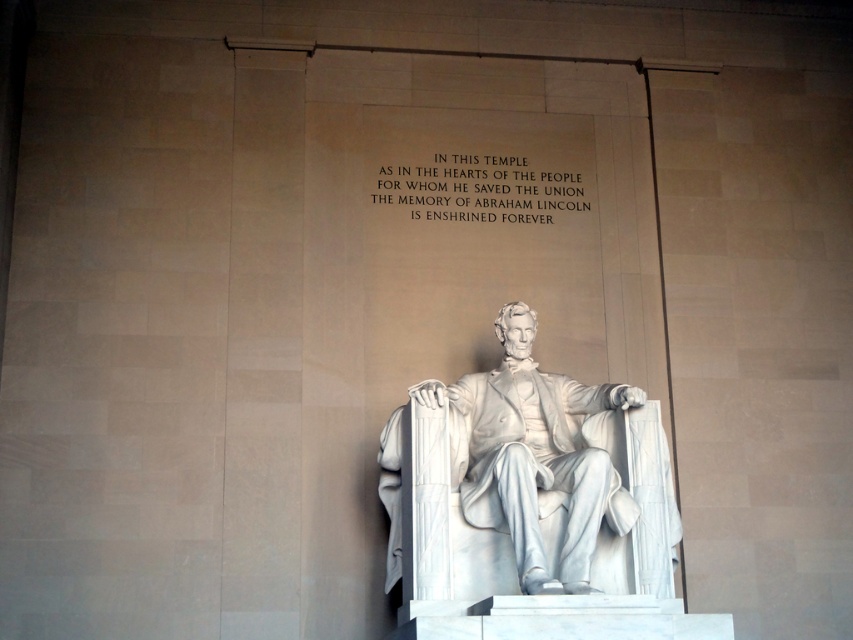
Question: Can you confirm if white marble statue at center is positioned above white stone text at upper center?

Choices:
 (A) yes
 (B) no

Answer: (B)

Question: Can you confirm if white marble statue at center is wider than white stone text at upper center?

Choices:
 (A) no
 (B) yes

Answer: (B)

Question: Which object is closer to the camera taking this photo?

Choices:
 (A) white stone text at upper center
 (B) white marble statue at center

Answer: (B)

Question: Does white marble statue at center lie in front of white stone text at upper center?

Choices:
 (A) yes
 (B) no

Answer: (A)

Question: Among these objects, which one is farthest from the camera?

Choices:
 (A) white marble statue at center
 (B) white stone text at upper center

Answer: (B)